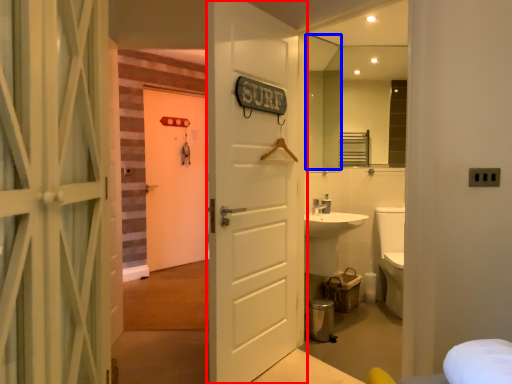
Question: Which of the following is the closest to the observer, door (highlighted by a red box) or mirror (highlighted by a blue box)?

Choices:
 (A) door
 (B) mirror

Answer: (A)